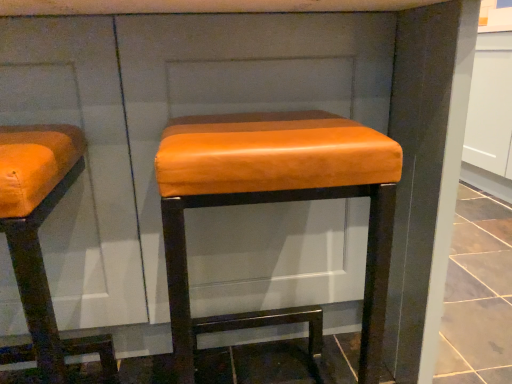
Question: Would you say orange leather stool at left contains matte orange leather stool at center?

Choices:
 (A) yes
 (B) no

Answer: (B)

Question: From the image's perspective, is orange leather stool at left below matte orange leather stool at center?

Choices:
 (A) no
 (B) yes

Answer: (B)

Question: From the image's perspective, is orange leather stool at left on top of matte orange leather stool at center?

Choices:
 (A) no
 (B) yes

Answer: (A)

Question: Is orange leather stool at left not inside matte orange leather stool at center?

Choices:
 (A) yes
 (B) no

Answer: (A)

Question: Does orange leather stool at left have a lesser height compared to matte orange leather stool at center?

Choices:
 (A) yes
 (B) no

Answer: (A)

Question: Is orange leather stool at left turned away from matte orange leather stool at center?

Choices:
 (A) no
 (B) yes

Answer: (A)

Question: Considering the relative sizes of matte orange leather stool at center and orange leather stool at left in the image provided, is matte orange leather stool at center thinner than orange leather stool at left?

Choices:
 (A) no
 (B) yes

Answer: (A)

Question: From the image's perspective, is matte orange leather stool at center over orange leather stool at left?

Choices:
 (A) no
 (B) yes

Answer: (B)

Question: From a real-world perspective, is matte orange leather stool at center physically below orange leather stool at left?

Choices:
 (A) yes
 (B) no

Answer: (A)

Question: Would you say matte orange leather stool at center contains orange leather stool at left?

Choices:
 (A) no
 (B) yes

Answer: (A)

Question: Considering the relative sizes of matte orange leather stool at center and orange leather stool at left in the image provided, is matte orange leather stool at center smaller than orange leather stool at left?

Choices:
 (A) yes
 (B) no

Answer: (B)

Question: Does matte orange leather stool at center turn towards orange leather stool at left?

Choices:
 (A) yes
 (B) no

Answer: (B)

Question: From the image's perspective, relative to orange leather stool at left, is matte orange leather stool at center above or below?

Choices:
 (A) below
 (B) above

Answer: (B)